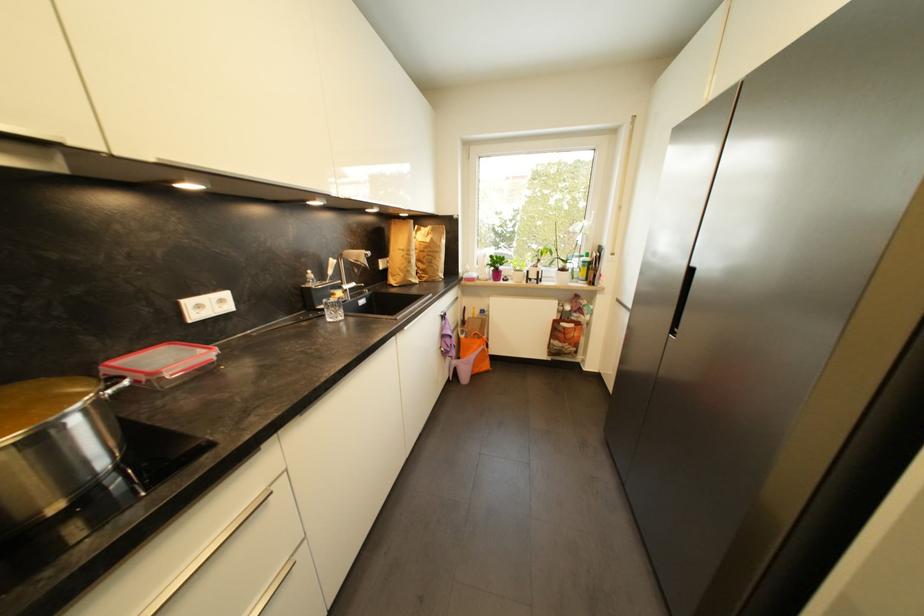
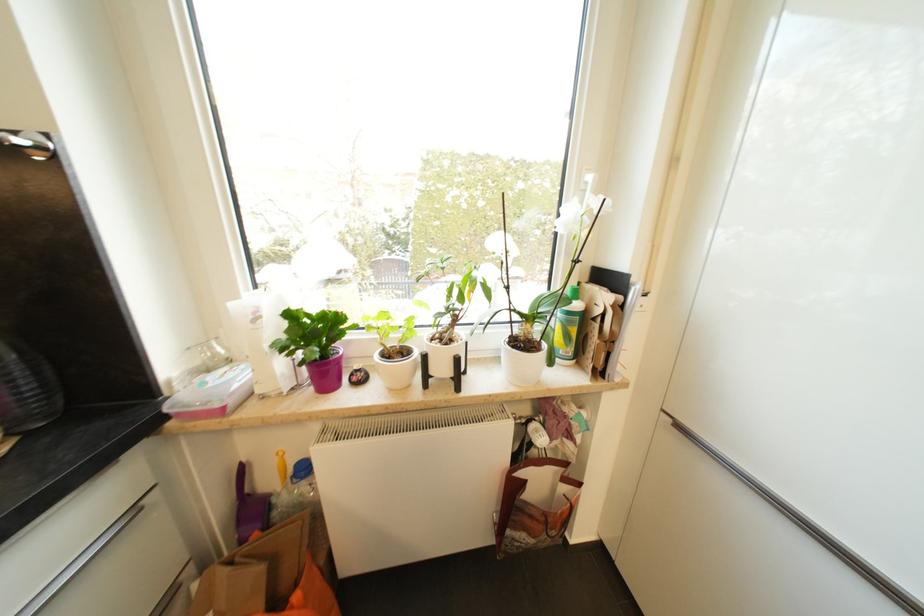
In the second image, find the point that corresponds to point (623, 302) in the first image.

(685, 429)